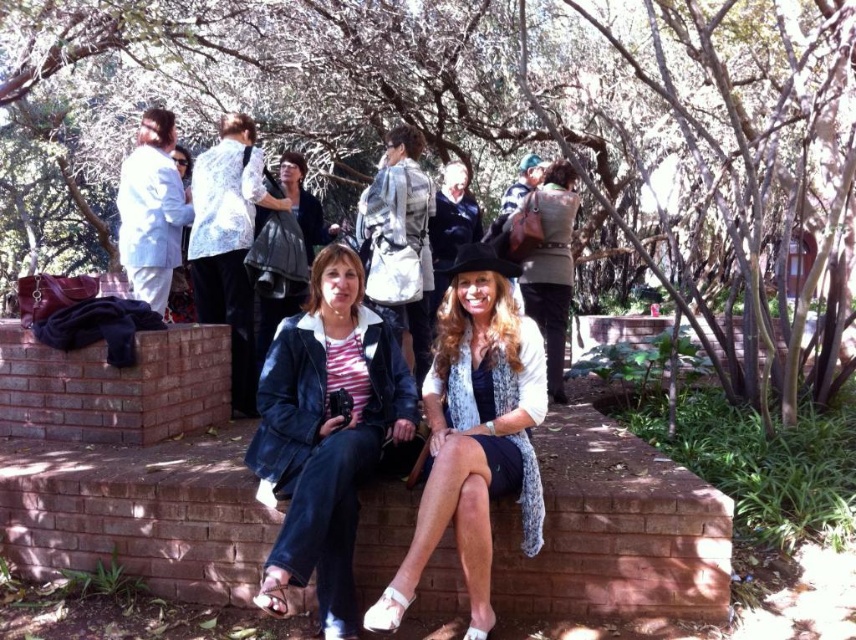
Question: Does denim jacket at center appear on the right side of dark gray fabric jacket at upper center?

Choices:
 (A) yes
 (B) no

Answer: (A)

Question: Is denim jacket at center above matte black hat at center?

Choices:
 (A) yes
 (B) no

Answer: (B)

Question: Based on their relative distances, which object is nearer to the dark gray fabric jacket at upper center?

Choices:
 (A) green textured sweater at center
 (B) denim jacket at center
 (C) matte black hat at center
 (D) green leafy tree at center

Answer: (A)

Question: Which of the following is the farthest from the observer?

Choices:
 (A) (544, 170)
 (B) (825, 92)

Answer: (A)

Question: Which point is closer to the camera?

Choices:
 (A) denim jacket at center
 (B) dark gray fabric jacket at upper center
 (C) matte black hat at center
 (D) green leafy tree at center

Answer: (C)

Question: Can you confirm if matte black hat at center is smaller than green textured sweater at center?

Choices:
 (A) yes
 (B) no

Answer: (A)